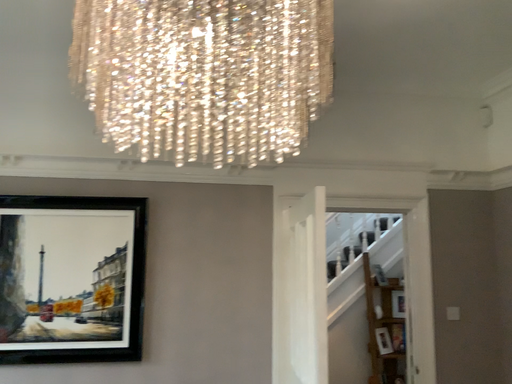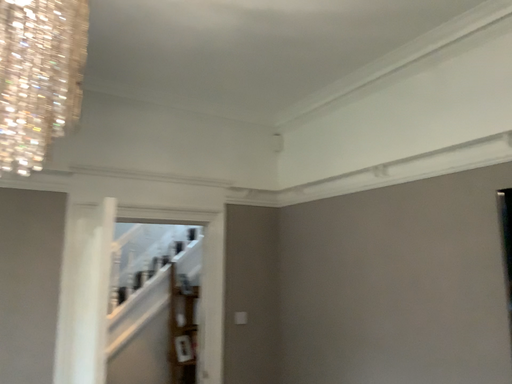
Question: How did the camera likely rotate when shooting the video?

Choices:
 (A) rotated left
 (B) rotated right

Answer: (B)